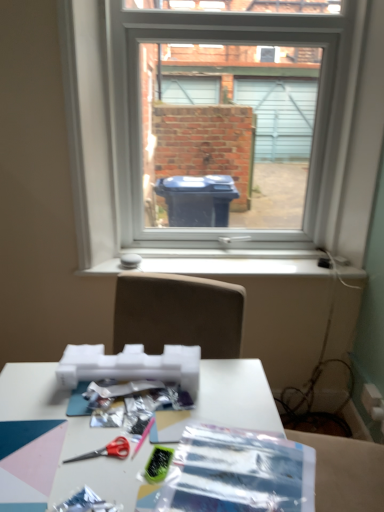
In order to click on free space behind red plastic scissors at lower center in this screenshot , I will do `click(99, 409)`.